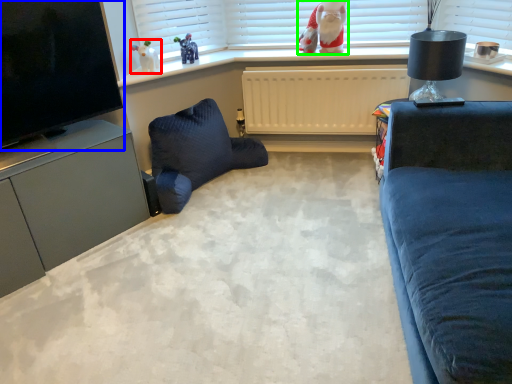
Question: Considering the real-world distances, which object is closest to toy (highlighted by a red box)? television (highlighted by a blue box) or doll (highlighted by a green box).

Choices:
 (A) television
 (B) doll

Answer: (A)